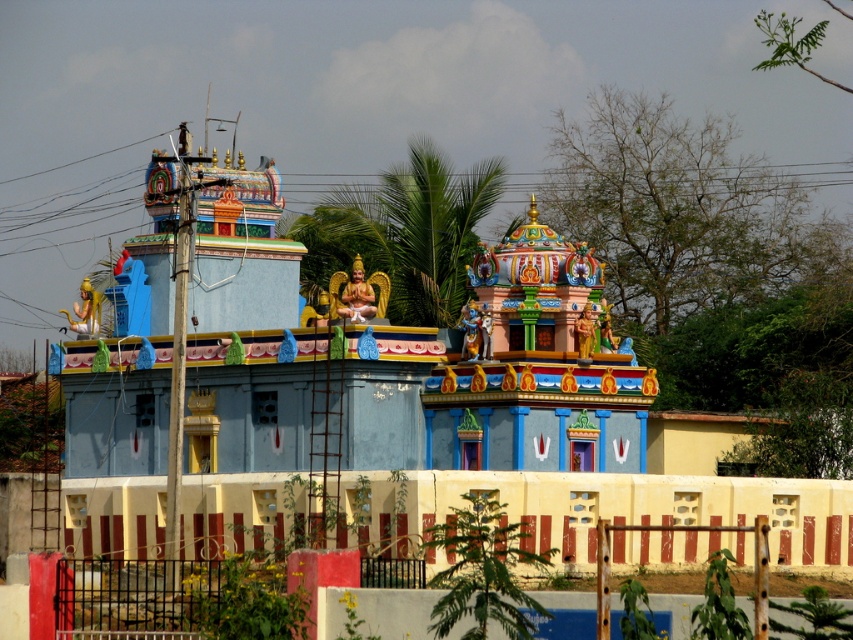
Question: Which point is closer to the camera?

Choices:
 (A) (587, 326)
 (B) (352, 289)
 (C) (85, 284)

Answer: (A)

Question: Is gold metallic statue at center wider than golden statue at center?

Choices:
 (A) no
 (B) yes

Answer: (B)

Question: Among these objects, which one is farthest from the camera?

Choices:
 (A) golden statue at center
 (B) gold metallic statue at center

Answer: (B)

Question: Does golden statue at upper left have a lesser width compared to golden statue at center?

Choices:
 (A) no
 (B) yes

Answer: (A)

Question: Which object is closer to the camera taking this photo?

Choices:
 (A) golden statue at upper left
 (B) golden statue at center

Answer: (B)

Question: Can you confirm if gold metallic statue at center is bigger than golden statue at upper left?

Choices:
 (A) yes
 (B) no

Answer: (B)